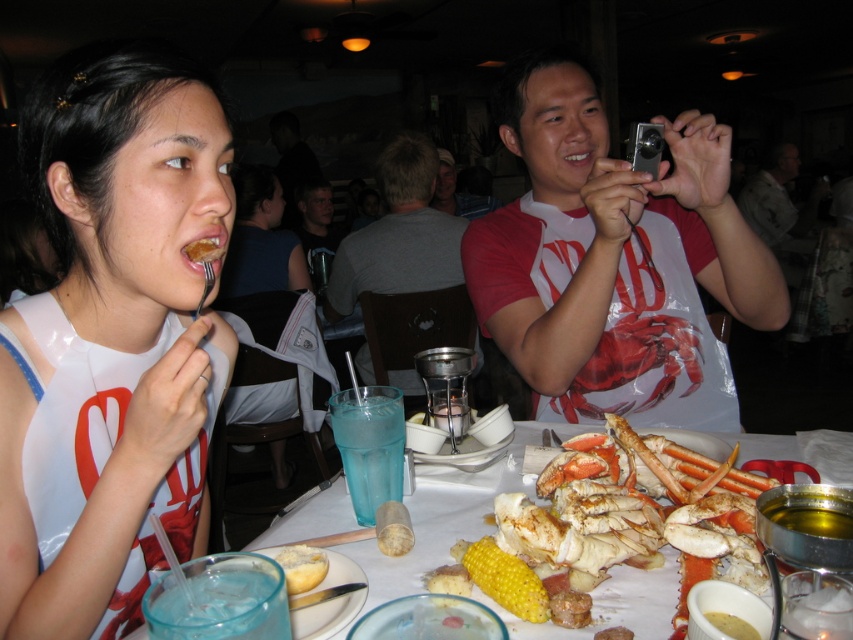
Question: In this image, where is matte white shirt at upper left located relative to brown crumbly food at mouth?

Choices:
 (A) right
 (B) left

Answer: (B)

Question: Considering the real-world distances, which object is closest to the matte silver camera at upper right?

Choices:
 (A) brown crumbly food at mouth
 (B) golden corn cob at center

Answer: (B)

Question: Does golden corn cob at center have a lesser width compared to golden bread at center?

Choices:
 (A) yes
 (B) no

Answer: (B)

Question: Can you confirm if matte white shirt at upper left is positioned below matte silver camera at upper right?

Choices:
 (A) no
 (B) yes

Answer: (B)

Question: Among these objects, which one is farthest from the camera?

Choices:
 (A) matte white shirt at upper left
 (B) golden corn cob at center

Answer: (A)

Question: Which point is closer to the camera?

Choices:
 (A) golden bread at center
 (B) brown crumbly food at mouth

Answer: (A)